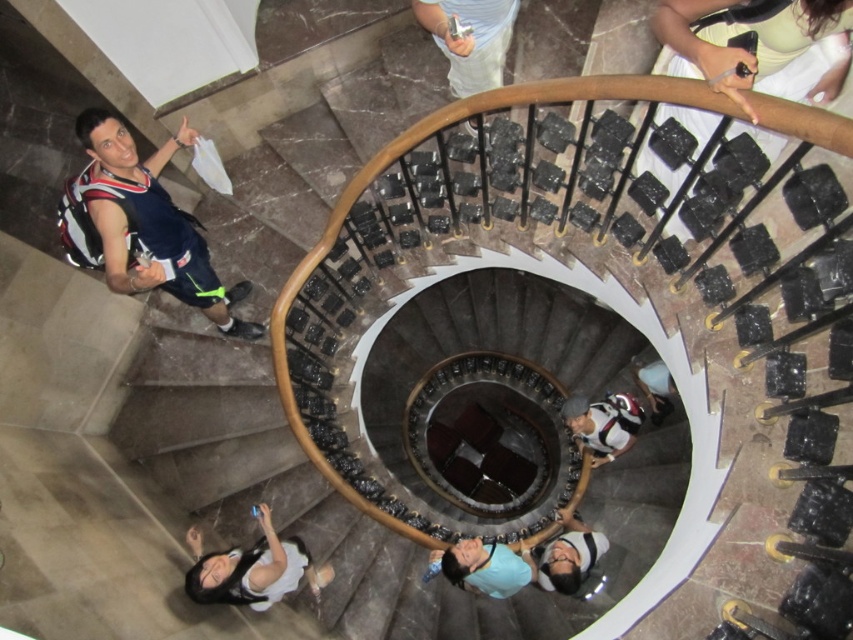
You are standing at the bottom of the spiral staircase and want to take a photo of two specific points marked in the image. The first point is at coordinates point (x=450, y=576), and the second is at point (x=630, y=413). Which point should you focus on first to ensure it appears larger in your photo?

Point (x=450, y=576) is closer to the camera than point (x=630, y=413), so focusing on point (x=450, y=576) first will make it appear larger in your photo.

You are standing on the spiral staircase and want to take a photo of both the matte blue shirt at center and the matte black backpack at center in the same frame. Can you fit both into your camera view without moving your position?

The matte blue shirt at center and the matte black backpack at center are 5.21 feet apart from each other. Since the distance between them is 5.21 feet, it depends on your camera lens. If your camera has a wide enough angle or zoom capability to capture objects 5.21 feet apart at this distance, then yes, they can be in the same frame. Otherwise, you might need to adjust your position or lens.

You are standing at the bottom of the spiral staircase and want to take a photo of the person wearing the matte blue shirt at center. However, the matte black backpack at center is blocking your view. Can you estimate if the backpack is wider than the shirt, making it impossible to see the shirt without moving the backpack?

The matte blue shirt at center might be wider than matte black backpack at center, so there is a possibility that the backpack is not wider than the shirt. However, since the exact width difference is uncertain, it might still block the view depending on their positions.